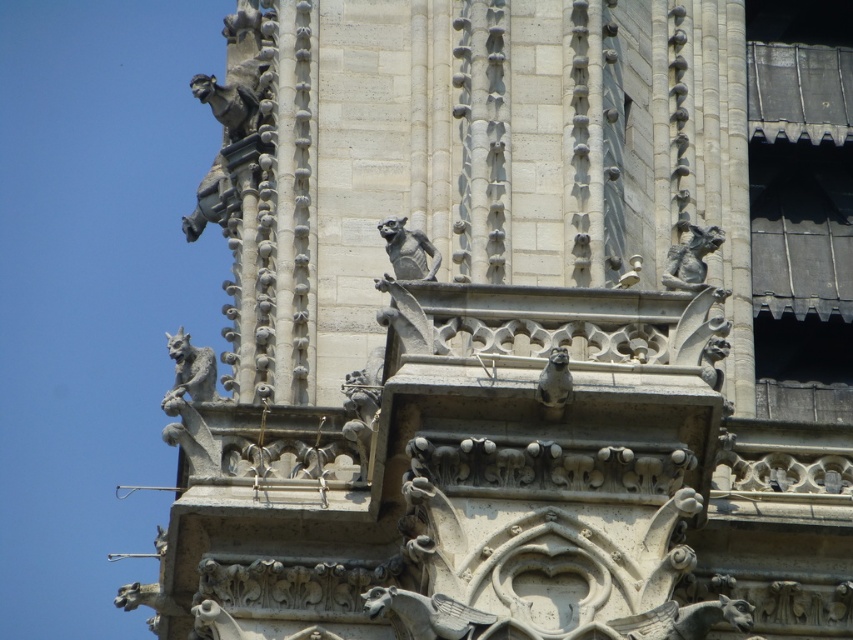
Does slate gray stone gargoyle at center have a greater width compared to sculpted stone gargoyle at upper right?

Yes.

Is point (421, 253) in front of point (712, 232)?

Yes, it is.

Image resolution: width=853 pixels, height=640 pixels. I want to click on slate gray stone gargoyle at center, so click(408, 250).

Who is more distant from viewer, [413,234] or [564,356]?

Positioned behind is point [413,234].

Who is positioned more to the left, slate gray stone gargoyle at center or matte stone gargoyle at center?

Positioned to the left is slate gray stone gargoyle at center.

Is point (384, 227) in front of point (561, 390)?

That is False.

Where is `slate gray stone gargoyle at center`? The height and width of the screenshot is (640, 853). slate gray stone gargoyle at center is located at coordinates (408, 250).

Can you confirm if sculpted stone gargoyle at upper right is positioned below matte stone gargoyle at center?

No, sculpted stone gargoyle at upper right is not below matte stone gargoyle at center.

Who is positioned more to the left, sculpted stone gargoyle at upper right or matte stone gargoyle at center?

Positioned to the left is matte stone gargoyle at center.

This screenshot has width=853, height=640. What do you see at coordinates (689, 259) in the screenshot? I see `sculpted stone gargoyle at upper right` at bounding box center [689, 259].

Where is `sculpted stone gargoyle at upper right`? sculpted stone gargoyle at upper right is located at coordinates (689, 259).